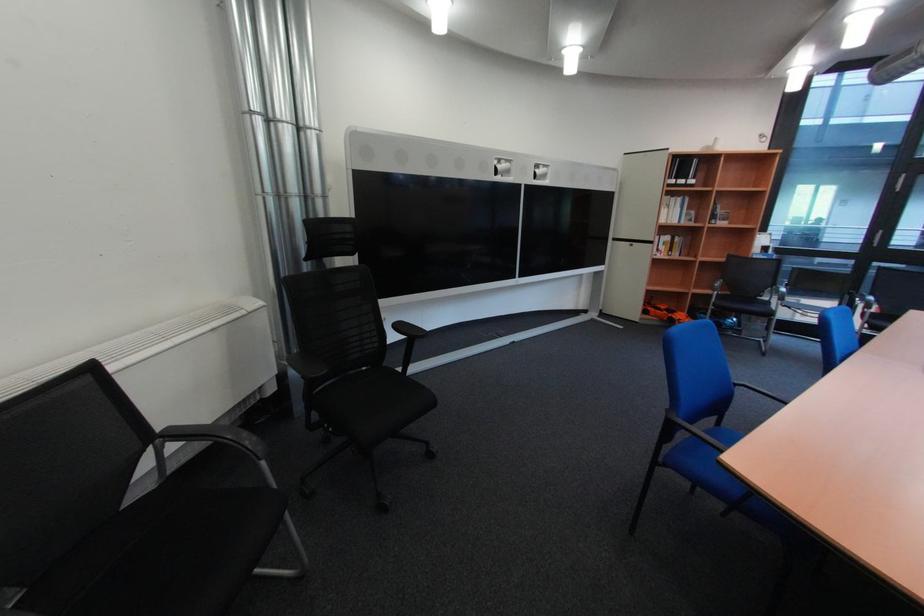
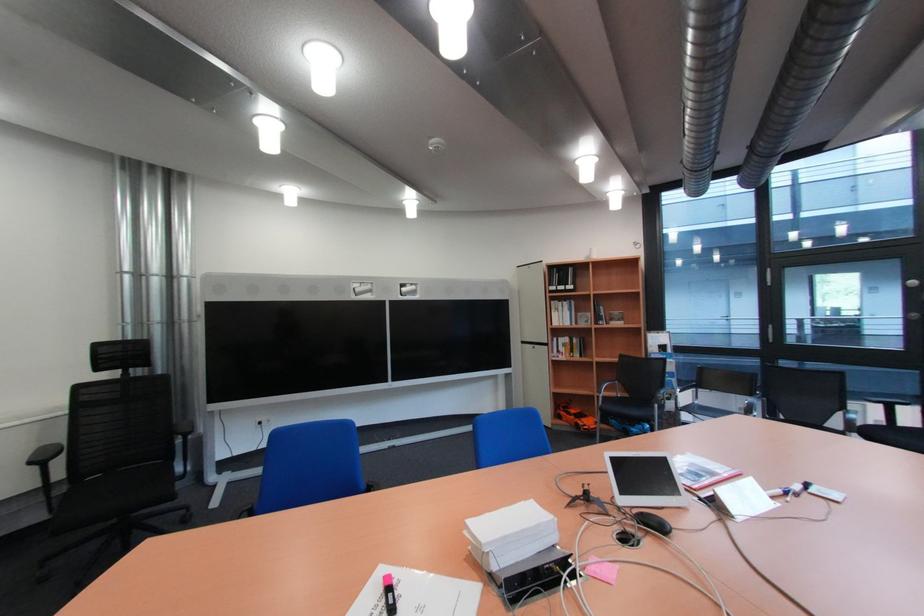
Question: Which direction would the cameraman need to move to produce the second image? Reply with the corresponding letter.

Choices:
 (A) Left
 (B) Right
 (C) Forward
 (D) Backward

Answer: (B)